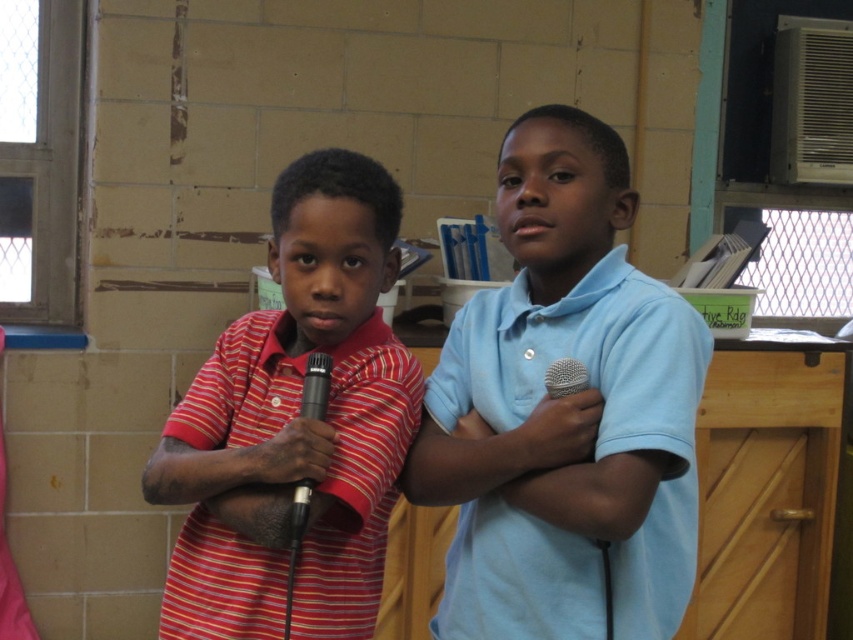
Question: Which of the following is the closest to the observer?

Choices:
 (A) black matte microphone at center
 (B) striped cotton shirt at center

Answer: (B)

Question: Considering the relative positions of matte blue shirt at center and black matte microphone at center in the image provided, where is matte blue shirt at center located with respect to black matte microphone at center?

Choices:
 (A) left
 (B) right

Answer: (A)

Question: Does striped cotton shirt at center appear over black matte microphone at center?

Choices:
 (A) no
 (B) yes

Answer: (A)

Question: Is matte blue shirt at center further to the viewer compared to black matte microphone at center?

Choices:
 (A) no
 (B) yes

Answer: (A)

Question: Among these points, which one is nearest to the camera?

Choices:
 (A) (345, 177)
 (B) (561, 380)

Answer: (B)

Question: Which object is closer to the camera taking this photo?

Choices:
 (A) black metallic microphone at center
 (B) matte blue shirt at center
 (C) black matte microphone at center

Answer: (B)